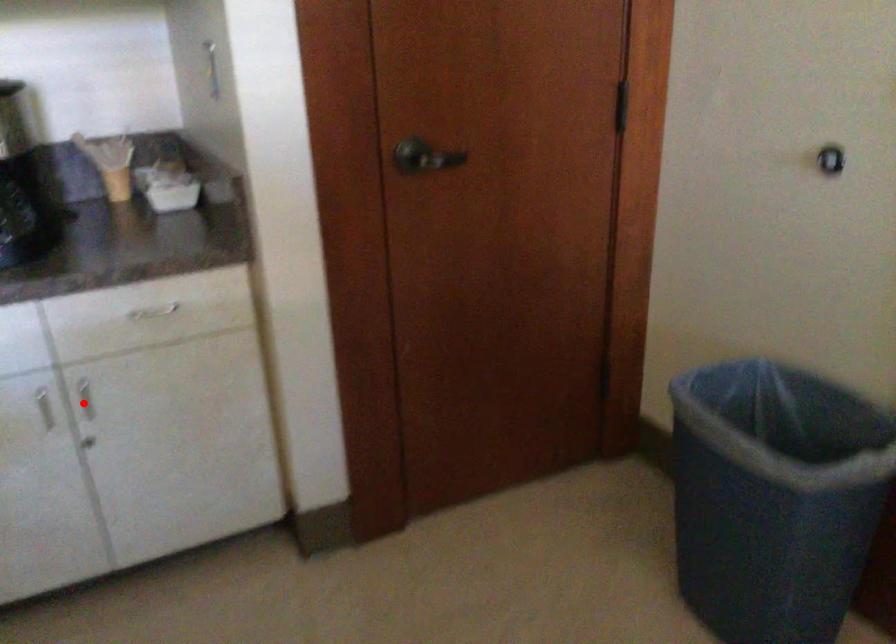
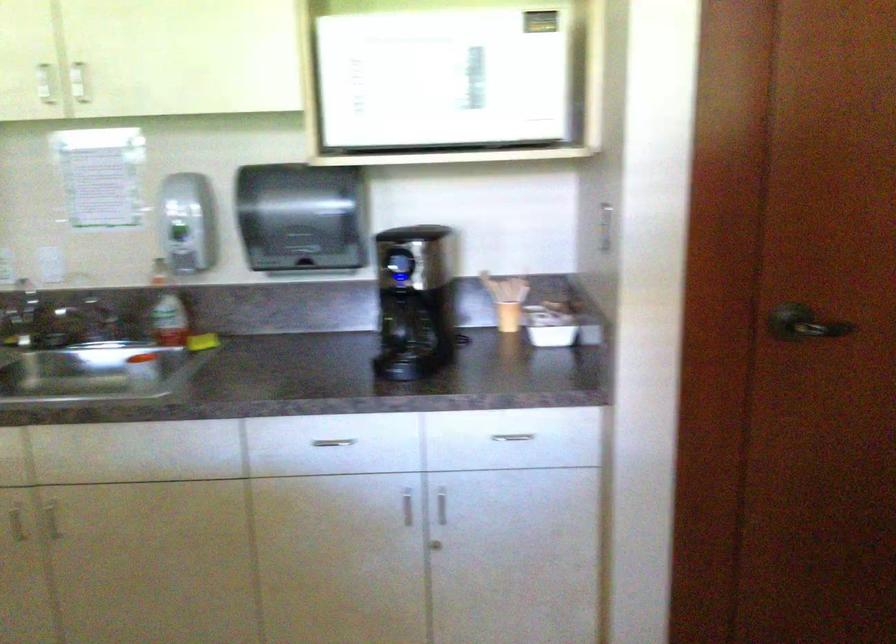
Question: I am providing you with two images of the same scene from different viewpoints. A red point is shown in image1. For the corresponding object point in image2, is it positioned nearer or farther from the camera?

Choices:
 (A) Nearer
 (B) Farther

Answer: (B)